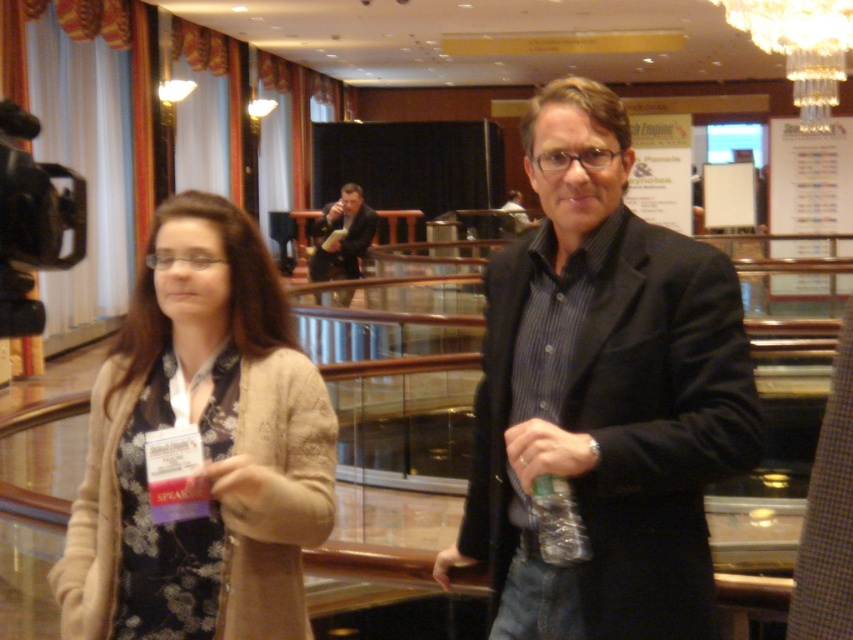
Question: Is matte black jacket at center wider than matte black suit at center?

Choices:
 (A) yes
 (B) no

Answer: (A)

Question: Which object is farther from the camera taking this photo?

Choices:
 (A) dark suit at center
 (B) floral-patterned fabric at center
 (C) matte black jacket at center
 (D) matte black suit at center

Answer: (D)

Question: Which point is farther to the camera?

Choices:
 (A) floral-patterned fabric at center
 (B) matte black jacket at center
 (C) black textured blazer at center

Answer: (A)

Question: Does matte black jacket at center appear under matte black suit at center?

Choices:
 (A) no
 (B) yes

Answer: (B)

Question: Which of the following is the farthest from the observer?

Choices:
 (A) (178, 595)
 (B) (602, 305)
 (C) (654, 477)

Answer: (A)

Question: Can you confirm if matte black jacket at center is positioned to the right of black textured blazer at center?

Choices:
 (A) no
 (B) yes

Answer: (B)